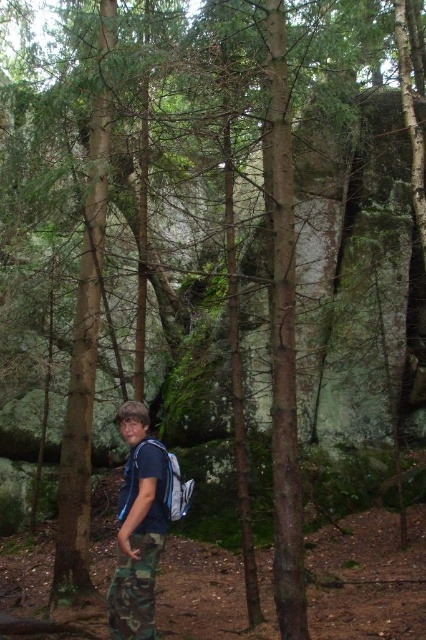
You are a hiker looking at your reflection in a mirror. You notice two items on your body. Which item is positioned to the left when viewed from your perspective? The camouflage pants at lower center and the matte blue backpack at center.

The camouflage pants at lower center are positioned to the left of the matte blue backpack at center from the hiker perspective.

You are a photographer trying to capture the hiker in the forest. You notice two pairs of camouflage pants in the scene. Which one is wider, the camo pants at center or the camouflage pants at lower center?

The camo pants at center might be wider than the camouflage pants at lower center according to the description.